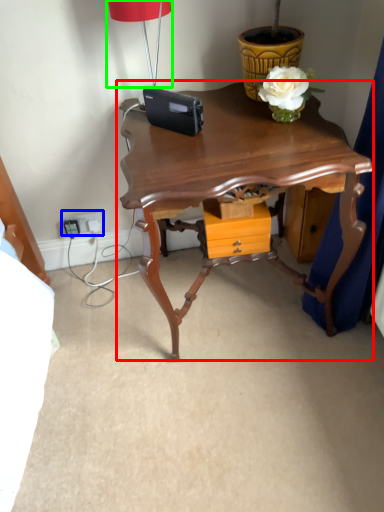
Question: Estimate the real-world distances between objects in this image. Which object is closer to table (highlighted by a red box), electric outlet (highlighted by a blue box) or lamp (highlighted by a green box)?

Choices:
 (A) electric outlet
 (B) lamp

Answer: (B)